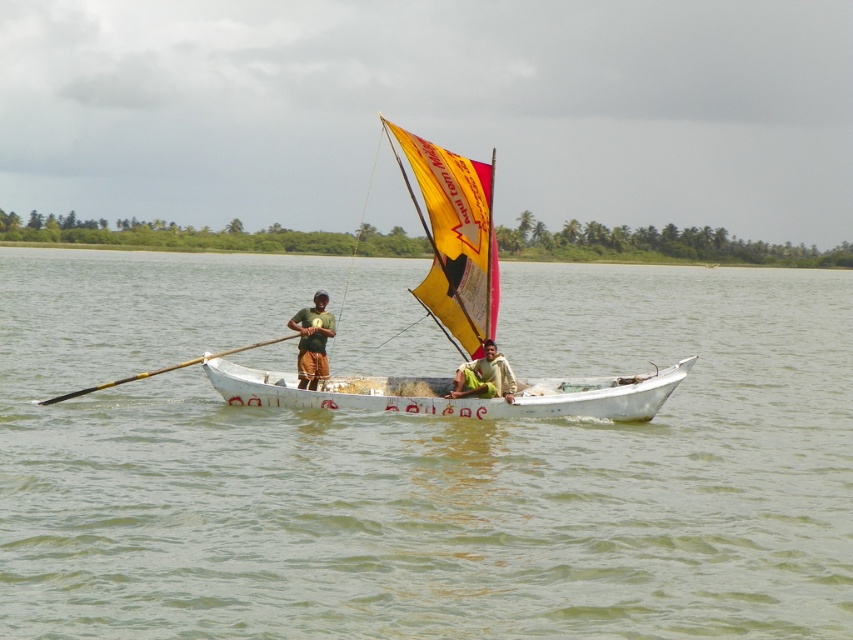
Question: Does yellow fabric sail at center have a greater width compared to wooden polished paddle at left?

Choices:
 (A) no
 (B) yes

Answer: (B)

Question: Which of the following is the farthest from the observer?

Choices:
 (A) (737, 369)
 (B) (474, 172)
 (C) (134, 376)

Answer: (A)

Question: Can you confirm if green water at center is positioned to the right of wooden polished paddle at left?

Choices:
 (A) no
 (B) yes

Answer: (B)

Question: Which point is farther to the camera?

Choices:
 (A) green fabric shirt at center
 (B) yellow fabric sail at center
 (C) green water at center

Answer: (A)

Question: Which point is farther to the camera?

Choices:
 (A) yellow fabric sail at center
 (B) white matte canoe at center

Answer: (B)

Question: Can you confirm if white painted wood sailboat at center is positioned below green fabric shirt at center?

Choices:
 (A) yes
 (B) no

Answer: (B)